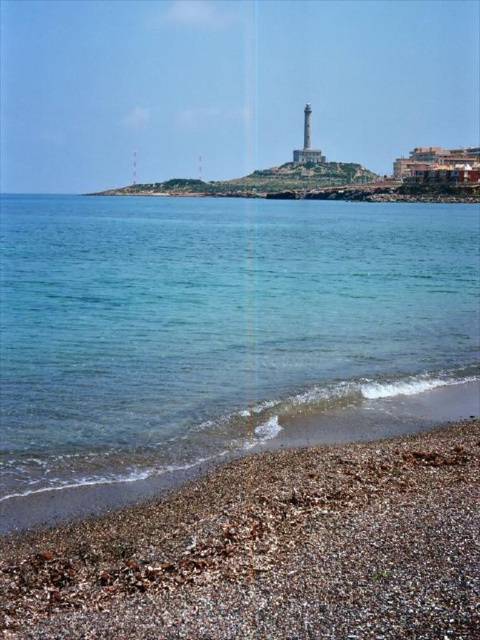
Can you confirm if clear water at lower left is positioned to the left of smooth pebbles at lower right?

In fact, clear water at lower left is to the right of smooth pebbles at lower right.

Which of these two, clear water at lower left or smooth pebbles at lower right, stands shorter?

smooth pebbles at lower right is shorter.

Does point (253, 332) come in front of point (434, 476)?

No, it is behind (434, 476).

The width and height of the screenshot is (480, 640). What are the coordinates of `clear water at lower left` in the screenshot? It's located at [216, 324].